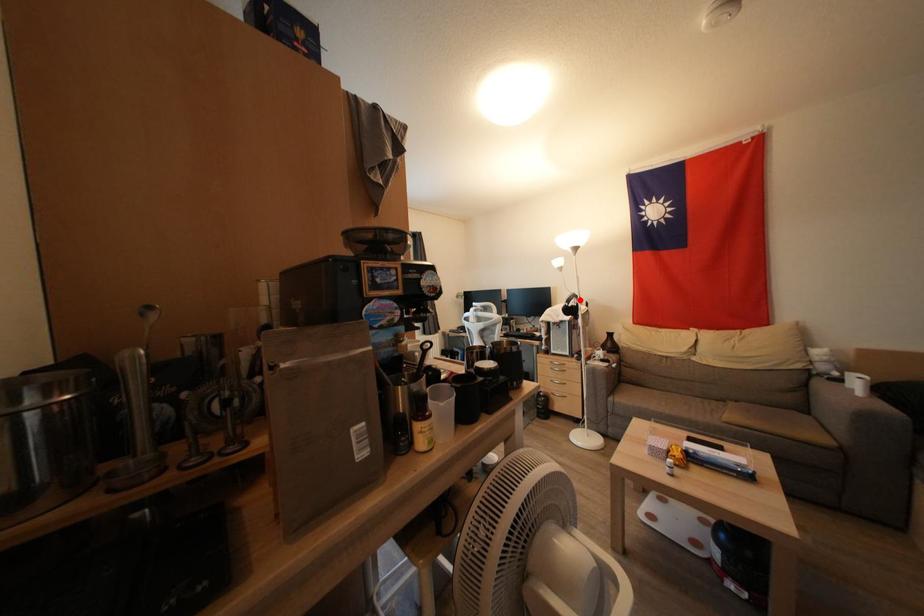
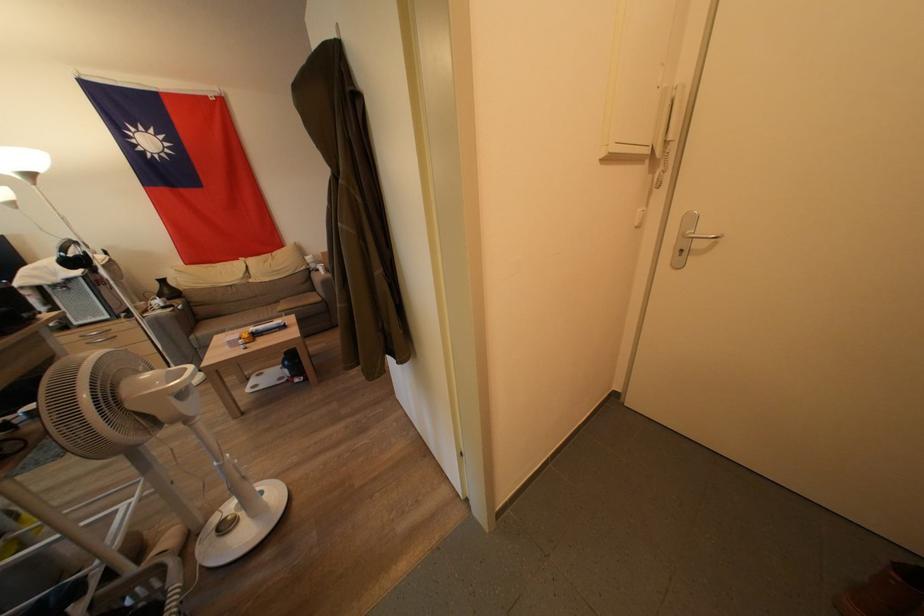
Question: A red point is marked in image1. In image2, is the corresponding 3D point closer to the camera or farther? Reply with the corresponding letter.

Choices:
 (A) The corresponding 3D point is closer.
 (B) The corresponding 3D point is farther.

Answer: (B)